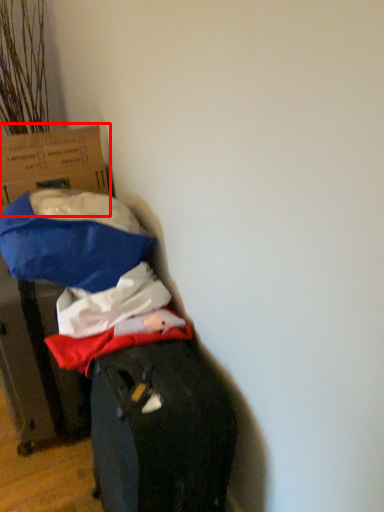
Question: From the image's perspective, what is the correct spatial positioning of cardboard box (annotated by the red box) in reference to cardboard box?

Choices:
 (A) above
 (B) below

Answer: (A)